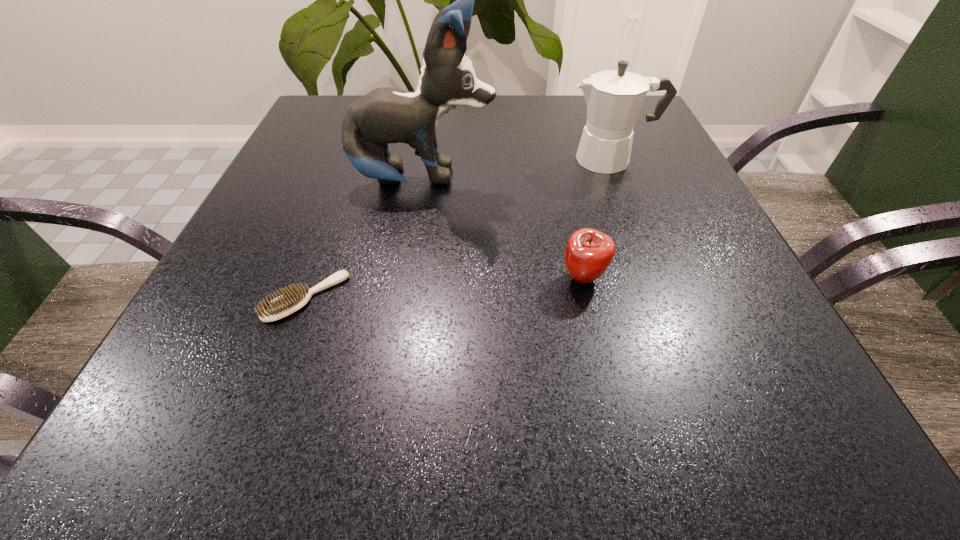
Find the location of `puppy`. puppy is located at coordinates (385, 115).

At what (x,y) coordinates should I click in order to perform the action: click on coffeepot. Please return your answer as a coordinate pair (x, y). This screenshot has width=960, height=540. Looking at the image, I should click on (614, 98).

Locate an element on the screen. This screenshot has height=540, width=960. apple is located at coordinates (589, 252).

Image resolution: width=960 pixels, height=540 pixels. In order to click on the shortest object in this screenshot , I will do `click(292, 299)`.

Image resolution: width=960 pixels, height=540 pixels. Identify the location of vacant space located on the front-facing side of the tallest object. (529, 179).

Find the location of `blank space located at the spout of the third shortest object`. blank space located at the spout of the third shortest object is located at coordinates (429, 160).

At what (x,y) coordinates should I click in order to perform the action: click on free space located 0.230m at the spout of the third shortest object. Please return your answer as a coordinate pair (x, y). Looking at the image, I should click on (457, 160).

Locate an element on the screen. The height and width of the screenshot is (540, 960). vacant space located at the spout of the third shortest object is located at coordinates (538, 160).

Locate an element on the screen. free location located on the left of the second shortest object is located at coordinates (x=478, y=278).

Image resolution: width=960 pixels, height=540 pixels. Find the location of `vacant area located 0.200m on the back of the scrubbing brush`. vacant area located 0.200m on the back of the scrubbing brush is located at coordinates (343, 199).